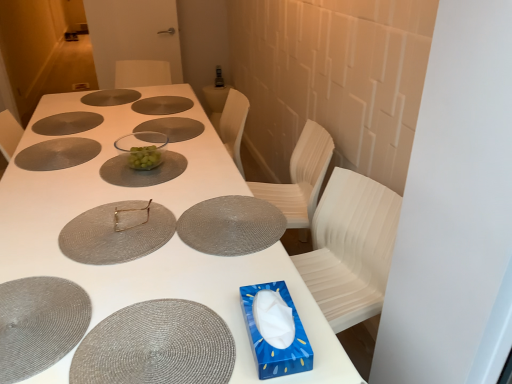
This screenshot has height=384, width=512. In order to click on vacant space in between matte gray glass plate at upper left, the fifth glass plate when ordered from front to back, and woven gray placemat at lower left in this screenshot , I will do `click(44, 199)`.